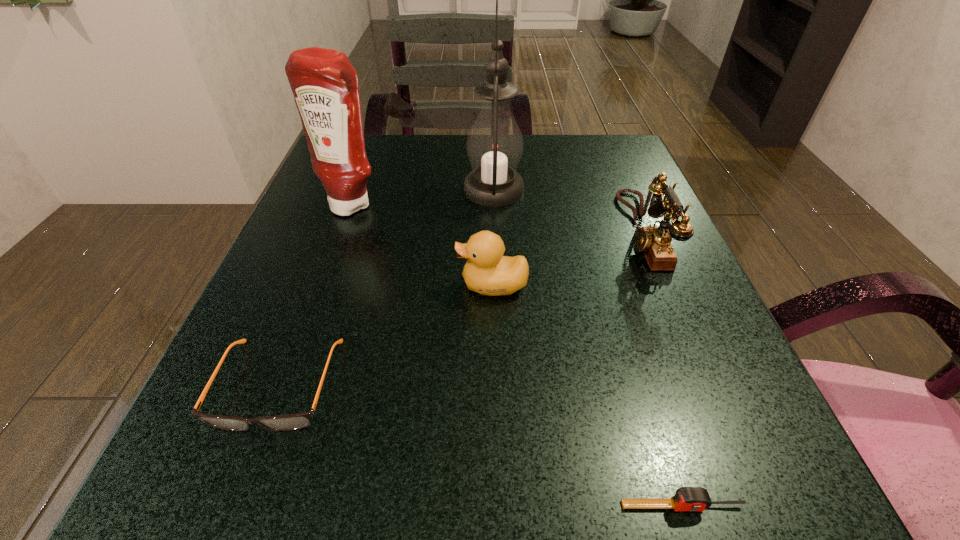
Where is `vacant space at the far right corner of the desktop`? Image resolution: width=960 pixels, height=540 pixels. vacant space at the far right corner of the desktop is located at coordinates (598, 163).

Where is `empty space between the condiment and the fourth tallest object`? This screenshot has height=540, width=960. empty space between the condiment and the fourth tallest object is located at coordinates (422, 245).

What are the coordinates of `empty space that is in between the shortest object and the third shortest object` in the screenshot? It's located at (588, 395).

Find the location of a particular element. This screenshot has width=960, height=540. vacant space that's between the condiment and the oil lamp is located at coordinates (423, 197).

In order to click on free area in between the telephone and the fourth tallest object in this screenshot , I will do `click(567, 258)`.

Locate an element on the screen. This screenshot has width=960, height=540. vacant area between the condiment and the fourth tallest object is located at coordinates (422, 245).

You are a GUI agent. You are given a task and a screenshot of the screen. Output one action in this format:
    pyautogui.click(x=<x>, y=<y>)
    Task: Click on the free space between the nearest object and the tallest object
    
    Given the screenshot: What is the action you would take?
    pyautogui.click(x=588, y=348)

Where is `free area in between the third shortest object and the shortest object`? free area in between the third shortest object and the shortest object is located at coordinates (588, 395).

Identify the location of free space between the shortest object and the duckling. This screenshot has width=960, height=540. (588, 395).

Find the location of a particular element. vacant point located between the duckling and the telephone is located at coordinates (567, 258).